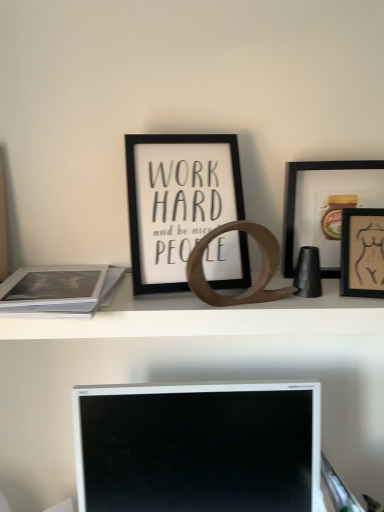
Question: From the image's perspective, relative to black matte picture frame at center, which appears as the first picture frame when viewed from the left, is wooden ring at center above or below?

Choices:
 (A) above
 (B) below

Answer: (B)

Question: Is wooden ring at center bigger or smaller than black matte picture frame at center, which appears as the first picture frame when viewed from the left?

Choices:
 (A) small
 (B) big

Answer: (B)

Question: Based on their relative distances, which object is nearer to the black matte picture frame at center, which appears as the first picture frame when viewed from the left?

Choices:
 (A) white matte paper at left
 (B) matte black picture frame at upper right, the 3th picture frame from the left
 (C) wooden ring at center
 (D) white glossy computer monitor at center
 (E) matte black picture frame at right, arranged as the second picture frame when viewed from the left

Answer: (C)

Question: Estimate the real-world distances between objects in this image. Which object is closer to the black matte picture frame at center, the 3th picture frame from the right?

Choices:
 (A) matte black picture frame at upper right, the 3th picture frame from the left
 (B) white matte paper at left
 (C) wooden ring at center
 (D) white glossy computer monitor at center
 (E) matte black picture frame at right, arranged as the second picture frame when viewed from the left

Answer: (C)